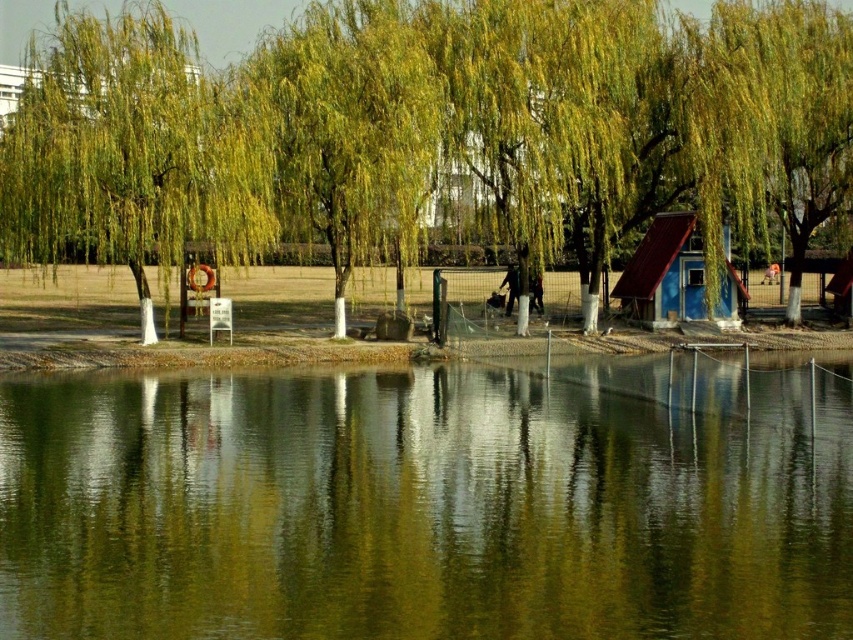
In the scene shown: You are standing at the lakeside and want to determine which of the two points, point (53, 582) or point (647, 236), is closer to you. Based on the scene description, which point is nearer?

Point (53, 582) is closer to the viewer than point (647, 236).

Consider the image. You are standing at the lakeside and want to take a photo of both the green reflective water at center and the green leafy tree at center. Which object will appear larger in your photo?

The green reflective water at center will appear larger in the photo because it is closer to the viewer than the green leafy tree at center.

You are standing at the edge of the lake and want to walk from the green reflective water at center to the green leafy tree at center. Which direction should you move to get closer to the tree?

The green leafy tree at center is wider than the green reflective water at center, so you should move towards the direction where the tree is located to get closer to it.